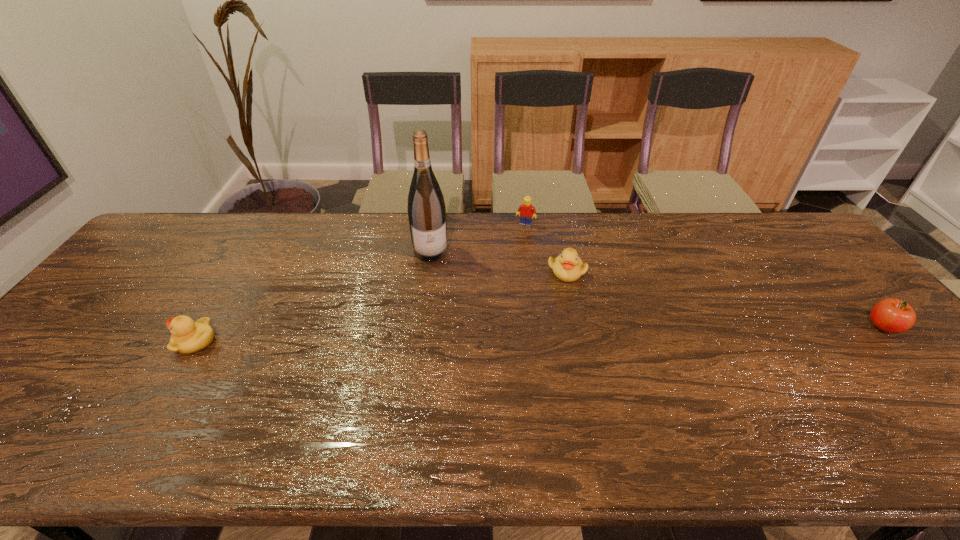
You are a GUI agent. You are given a task and a screenshot of the screen. Output one action in this format:
    pyautogui.click(x=<x>, y=<y>)
    Task: Click on the second closest object to the apple
    
    Given the screenshot: What is the action you would take?
    pyautogui.click(x=525, y=211)

Image resolution: width=960 pixels, height=540 pixels. Find the location of `object that can be found as the third closest to the left duckling`. object that can be found as the third closest to the left duckling is located at coordinates (525, 211).

I want to click on free space that satisfies the following two spatial constraints: 1. on the front side of the third object from left to right; 2. on the left side of the farther duckling, so (x=532, y=271).